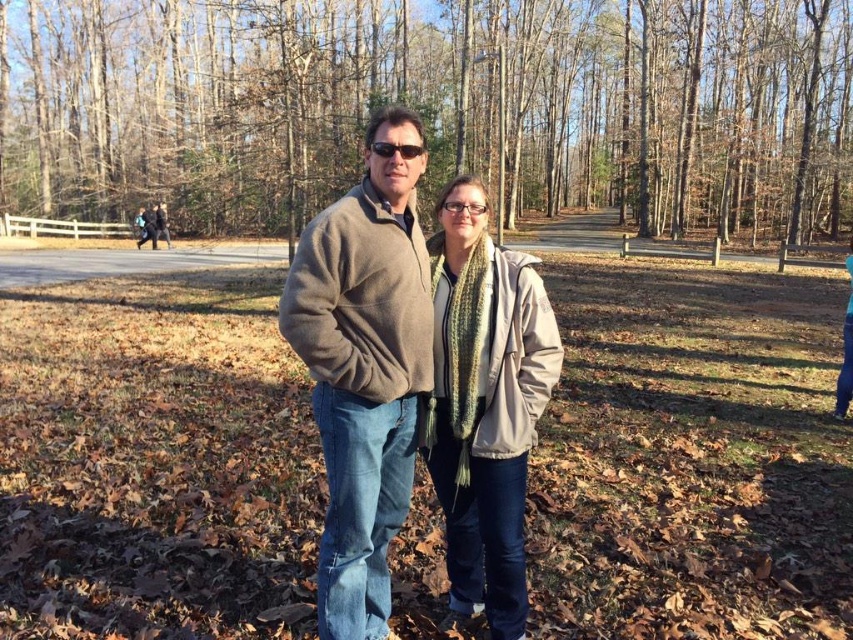
Is brown woolen sweater at center below knitted scarf at center?

No, brown woolen sweater at center is not below knitted scarf at center.

Measure the distance between brown woolen sweater at center and camera.

brown woolen sweater at center and camera are 2.71 meters apart.

This screenshot has height=640, width=853. Identify the location of brown woolen sweater at center. (691, 458).

Can you confirm if brown textured tree at center is wider than sunglasses at center?

Indeed, brown textured tree at center has a greater width compared to sunglasses at center.

Is brown textured tree at center bigger than sunglasses at center?

Indeed, brown textured tree at center has a larger size compared to sunglasses at center.

Locate an element on the screen. This screenshot has width=853, height=640. brown textured tree at center is located at coordinates (432, 108).

Can you confirm if brown woolen sweater at center is positioned below sunglasses at center?

Yes, brown woolen sweater at center is below sunglasses at center.

Which is in front, point (606, 445) or point (397, 145)?

Point (397, 145) is in front.

Locate an element on the screen. This screenshot has width=853, height=640. brown woolen sweater at center is located at coordinates (691, 458).

This screenshot has width=853, height=640. I want to click on brown woolen sweater at center, so pyautogui.click(x=691, y=458).